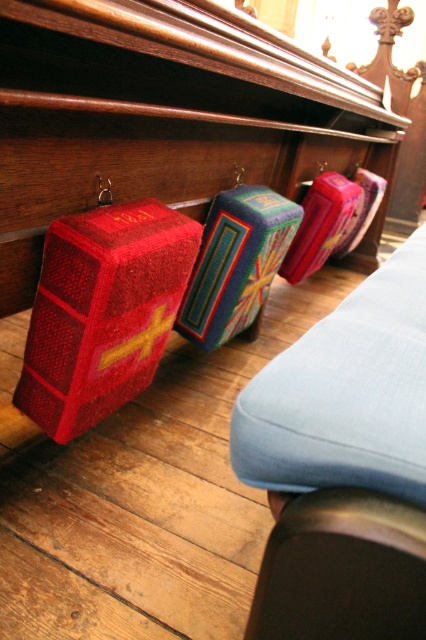
Question: Which object is closer to the camera taking this photo?

Choices:
 (A) matte blue cushion at center
 (B) velvet red book at left

Answer: (A)

Question: Does matte blue cushion at center appear on the right side of velvet red book at left?

Choices:
 (A) yes
 (B) no

Answer: (A)

Question: Does matte blue cushion at center appear over velvet red book at left?

Choices:
 (A) no
 (B) yes

Answer: (B)

Question: Which of the following is the farthest from the observer?

Choices:
 (A) matte blue cushion at center
 (B) velvet red book at left

Answer: (B)

Question: Is matte blue cushion at center to the left of velvet red book at left from the viewer's perspective?

Choices:
 (A) no
 (B) yes

Answer: (A)